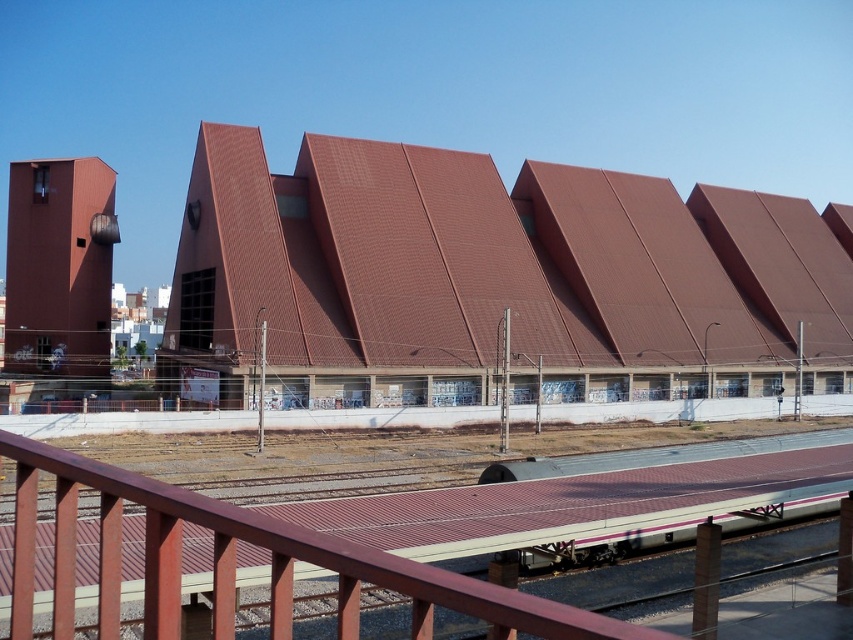
You are a maintenance worker needing to reach the brown corrugated metal roof at center and the metallic silver train at center. Which object is higher and requires a taller ladder?

The brown corrugated metal roof at center is taller than the metallic silver train at center, so you need a taller ladder to reach the brown corrugated metal roof at center.

You are a passenger waiting at the station and see the brown corrugated metal roof at center and the metallic silver train at center. Which object is positioned higher from the ground?

The brown corrugated metal roof at center is above the metallic silver train at center, so it is positioned higher from the ground.

You are a passenger at the station and want to board the metallic silver train at center. You are currently standing under the brown corrugated metal roof at center. Which direction should you move to reach the train?

Since the brown corrugated metal roof at center is closer to you than the metallic silver train at center, you should move away from the roof towards the direction where the train is located to reach it.